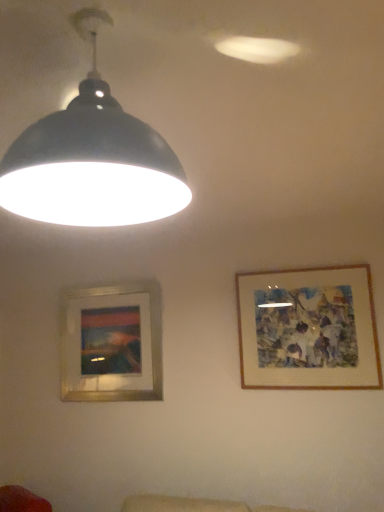
Question: From a real-world perspective, is wooden-framed artwork at upper right, the first picture frame positioned from the right, physically below silver metallic picture frame at lower left, arranged as the 2th picture frame when viewed from the front?

Choices:
 (A) no
 (B) yes

Answer: (A)

Question: Considering the relative sizes of wooden-framed artwork at upper right, the first picture frame positioned from the right, and silver metallic picture frame at lower left, the first picture frame viewed from the left, in the image provided, is wooden-framed artwork at upper right, the first picture frame positioned from the right, bigger than silver metallic picture frame at lower left, the first picture frame viewed from the left,?

Choices:
 (A) no
 (B) yes

Answer: (A)

Question: Considering the relative sizes of wooden-framed artwork at upper right, which appears as the second picture frame when viewed from the left, and silver metallic picture frame at lower left, which ranks as the second picture frame in right-to-left order, in the image provided, is wooden-framed artwork at upper right, which appears as the second picture frame when viewed from the left, wider than silver metallic picture frame at lower left, which ranks as the second picture frame in right-to-left order,?

Choices:
 (A) no
 (B) yes

Answer: (A)

Question: Are wooden-framed artwork at upper right, acting as the 2th picture frame starting from the back, and silver metallic picture frame at lower left, the 1th picture frame positioned from the back, beside each other?

Choices:
 (A) no
 (B) yes

Answer: (A)

Question: Could silver metallic picture frame at lower left, the first picture frame viewed from the left, be considered to be inside wooden-framed artwork at upper right, the first picture frame positioned from the right?

Choices:
 (A) yes
 (B) no

Answer: (B)

Question: Is wooden-framed artwork at upper right, which ranks as the first picture frame in front-to-back order, positioned with its back to silver metallic picture frame at lower left, which ranks as the second picture frame in right-to-left order?

Choices:
 (A) yes
 (B) no

Answer: (B)

Question: From the image's perspective, is matte black lampshade at upper left on top of silver metallic picture frame at lower left, the first picture frame viewed from the left?

Choices:
 (A) no
 (B) yes

Answer: (B)

Question: Does matte black lampshade at upper left turn towards silver metallic picture frame at lower left, the first picture frame viewed from the left?

Choices:
 (A) yes
 (B) no

Answer: (B)

Question: Is matte black lampshade at upper left thinner than silver metallic picture frame at lower left, arranged as the 2th picture frame when viewed from the front?

Choices:
 (A) yes
 (B) no

Answer: (B)

Question: From a real-world perspective, is matte black lampshade at upper left physically above silver metallic picture frame at lower left, the 1th picture frame positioned from the back?

Choices:
 (A) yes
 (B) no

Answer: (A)

Question: Could silver metallic picture frame at lower left, which ranks as the second picture frame in right-to-left order, be considered to be inside matte black lampshade at upper left?

Choices:
 (A) yes
 (B) no

Answer: (B)

Question: From a real-world perspective, is matte black lampshade at upper left below silver metallic picture frame at lower left, which ranks as the second picture frame in right-to-left order?

Choices:
 (A) no
 (B) yes

Answer: (A)

Question: Considering the relative positions of matte black lampshade at upper left and wooden-framed artwork at upper right, acting as the 2th picture frame starting from the back, in the image provided, is matte black lampshade at upper left behind wooden-framed artwork at upper right, acting as the 2th picture frame starting from the back,?

Choices:
 (A) yes
 (B) no

Answer: (B)